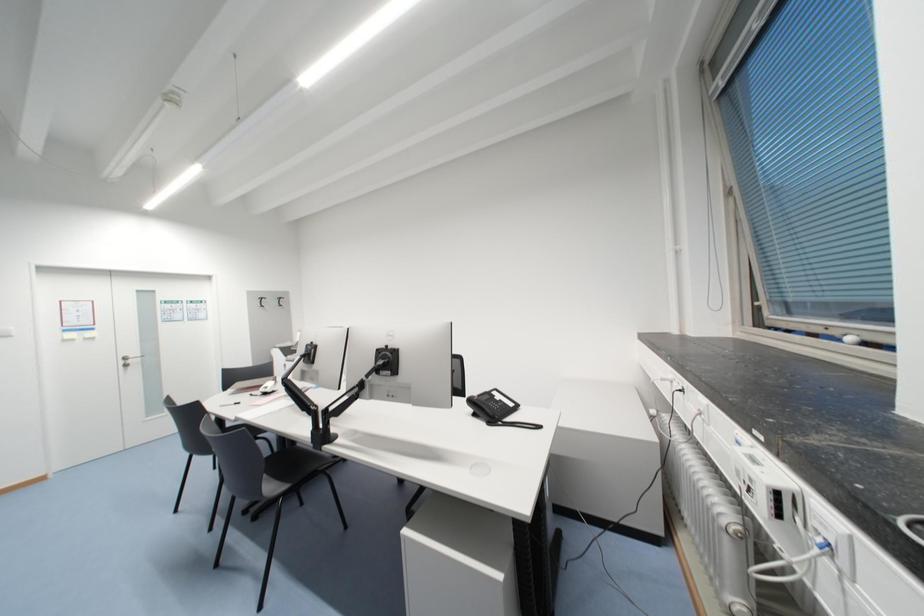
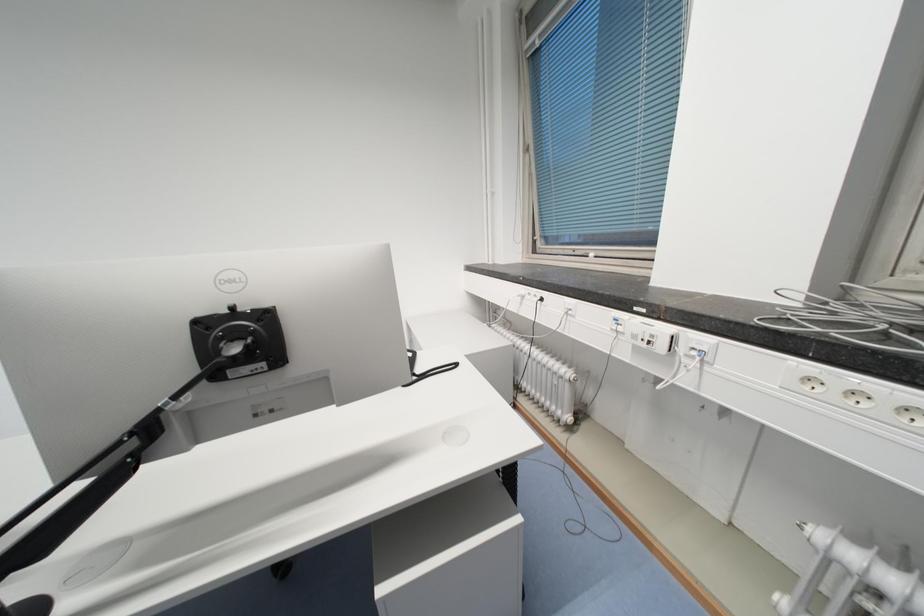
Question: The first image is from the beginning of the video and the second image is from the end. How did the camera likely rotate when shooting the video?

Choices:
 (A) Left
 (B) Right
 (C) Up
 (D) Down

Answer: (B)